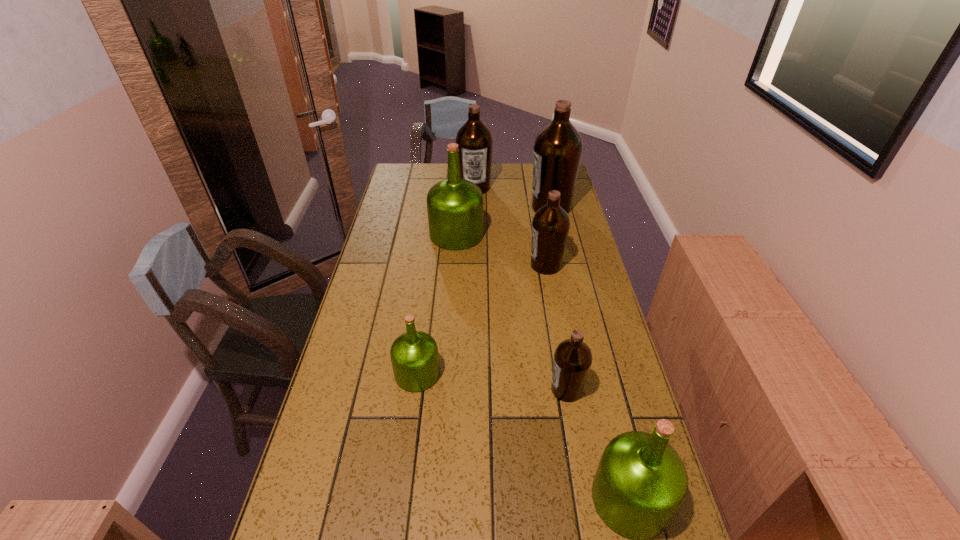
Locate an element on the screen. This screenshot has width=960, height=540. vacant space located 0.340m on the label of the smallest brown olive oil is located at coordinates (424, 389).

Where is `object located in the far edge section of the desktop`? The image size is (960, 540). object located in the far edge section of the desktop is located at coordinates (475, 142).

This screenshot has width=960, height=540. I want to click on vacant space at the far edge, so click(530, 165).

Where is `vacant space at the left edge of the desktop`? This screenshot has height=540, width=960. vacant space at the left edge of the desktop is located at coordinates (392, 208).

The height and width of the screenshot is (540, 960). What are the coordinates of `free space between the third farthest brown olive oil and the farthest green olive oil` in the screenshot? It's located at (501, 250).

Where is `vacant space in between the second nearest green olive oil and the fourth nearest object`? This screenshot has width=960, height=540. vacant space in between the second nearest green olive oil and the fourth nearest object is located at coordinates (482, 319).

I want to click on object identified as the closest to the biggest brown olive oil, so click(475, 142).

Where is `the closest object to the nearest brown olive oil`? This screenshot has width=960, height=540. the closest object to the nearest brown olive oil is located at coordinates tap(640, 483).

Identify which olive oil is the second closest to the biggest brown olive oil. Please provide its 2D coordinates. Your answer should be formatted as a tuple, i.e. [(x, y)], where the tuple contains the x and y coordinates of a point satisfying the conditions above.

[(454, 206)]

Where is `olive oil that stands as the second closest to the second farthest green olive oil`? The width and height of the screenshot is (960, 540). olive oil that stands as the second closest to the second farthest green olive oil is located at coordinates (640, 483).